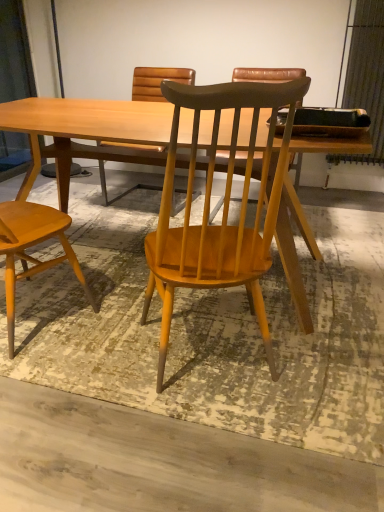
I want to click on vacant space in between wooden chair at center, arranged as the second chair when viewed from the left, and light brown wood chair at left, positioned as the 2th chair in right-to-left order, so click(108, 345).